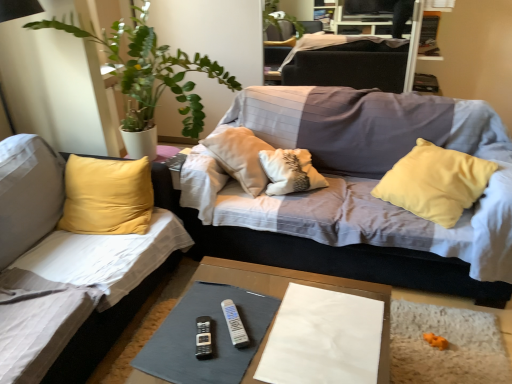
Image resolution: width=512 pixels, height=384 pixels. I want to click on unoccupied region to the right of white plastic remote at center, which is counted as the second remote, starting from the left, so click(x=280, y=323).